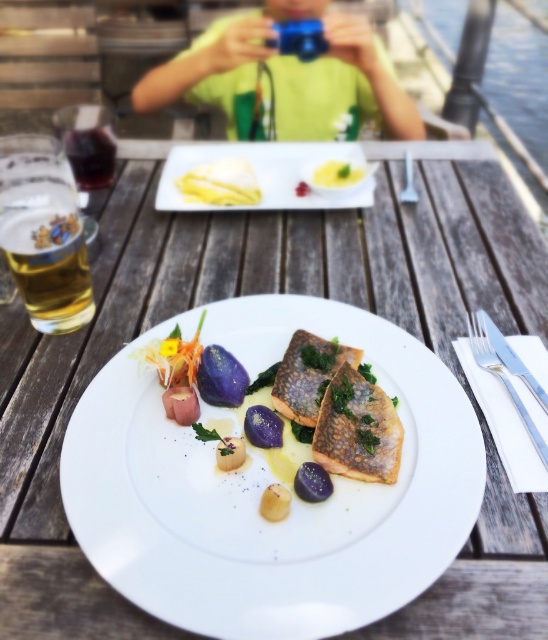
You are a chef trying to place a garnish between the white porcelain plate at center and the yellow creamy sauce at center. Given that the space between them is 11.55 inches, can you fit a 10 inch long garnish there?

The space between the white porcelain plate at center and the yellow creamy sauce at center is 11.55 inches, so yes, a 10 inch long garnish can fit in the space between them.

You are a guest at this outdoor dining event. You notice the white porcelain plate at center and the yellow creamy sauce at center. From your perspective, which one is positioned to the left?

The white porcelain plate at center is to the left of the yellow creamy sauce at center, so the white porcelain plate at center is positioned to the left.